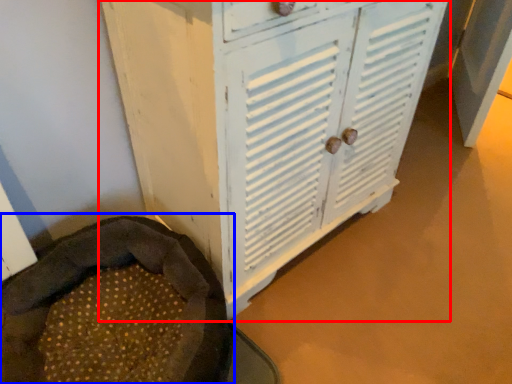
Question: Which object appears closest to the camera in this image, cupboard (highlighted by a red box) or bean bag chair (highlighted by a blue box)?

Choices:
 (A) cupboard
 (B) bean bag chair

Answer: (A)